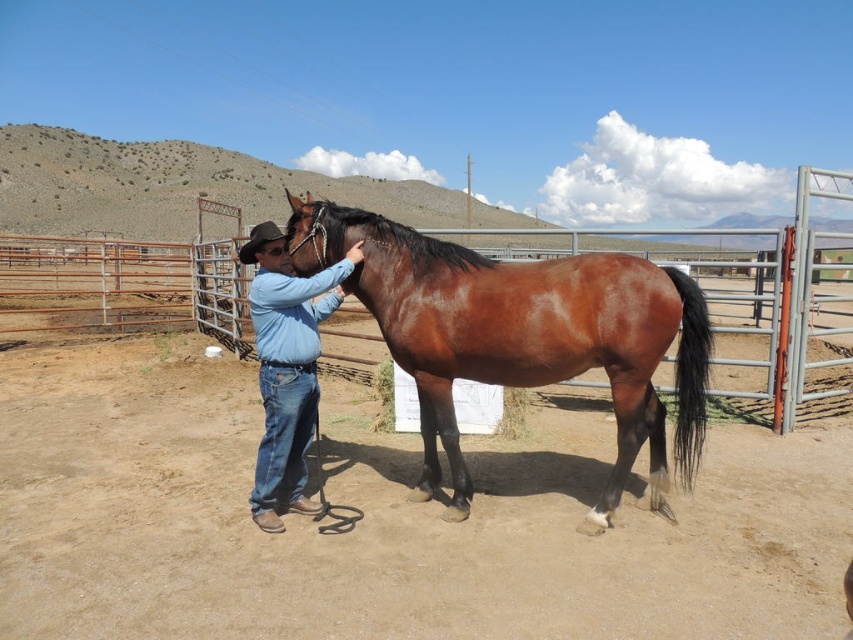
Question: Does brown glossy horse at center appear on the left side of blue jeans at center?

Choices:
 (A) yes
 (B) no

Answer: (B)

Question: Does brown glossy horse at center have a smaller size compared to blue jeans at center?

Choices:
 (A) no
 (B) yes

Answer: (A)

Question: Among these objects, which one is nearest to the camera?

Choices:
 (A) brown glossy horse at center
 (B) blue jeans at center

Answer: (A)

Question: Among these points, which one is farthest from the camera?

Choices:
 (A) (607, 326)
 (B) (273, 285)

Answer: (B)

Question: Is brown glossy horse at center further to camera compared to blue jeans at center?

Choices:
 (A) no
 (B) yes

Answer: (A)

Question: Which point is farther to the camera?

Choices:
 (A) brown glossy horse at center
 (B) blue jeans at center

Answer: (B)